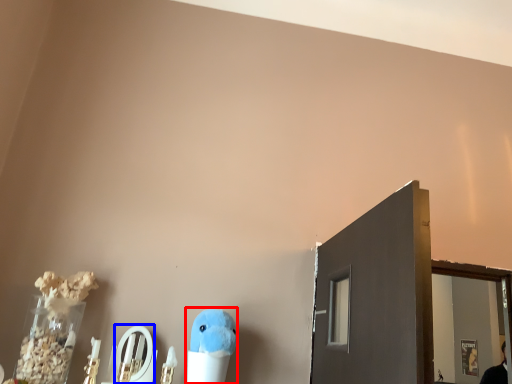
Question: Which of the following is the closest to the observer, toy (highlighted by a red box) or mirror (highlighted by a blue box)?

Choices:
 (A) toy
 (B) mirror

Answer: (A)